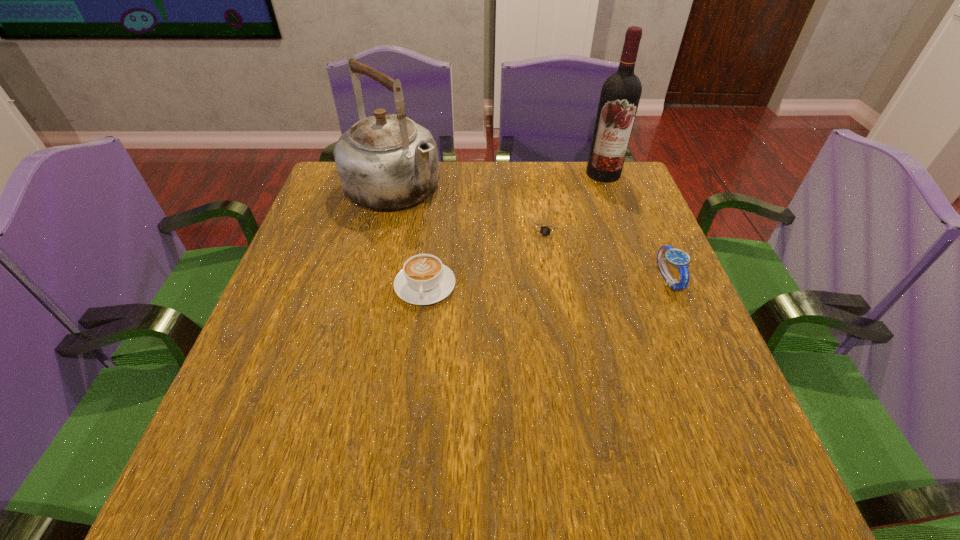
At what (x,y) coordinates should I click in order to perform the action: click on object that is at the left edge. Please return your answer as a coordinate pair (x, y). Looking at the image, I should click on (387, 161).

Image resolution: width=960 pixels, height=540 pixels. I want to click on watch located at the right edge, so click(x=678, y=258).

Find the location of a particular element. wine bottle at the right edge is located at coordinates (620, 95).

At what (x,y) coordinates should I click in order to perform the action: click on object present at the far left corner. Please return your answer as a coordinate pair (x, y). Looking at the image, I should click on (387, 161).

Where is `object at the far right corner`? The width and height of the screenshot is (960, 540). object at the far right corner is located at coordinates tap(620, 95).

Where is `vacant space at the far edge`? This screenshot has width=960, height=540. vacant space at the far edge is located at coordinates (483, 205).

Identify the location of vacant space at the left edge of the desktop. (326, 231).

Locate an element on the screen. This screenshot has height=540, width=960. vacant space at the right edge of the desktop is located at coordinates (703, 359).

In the image, there is a desktop. Find the location of `vacant space at the near left corner`. vacant space at the near left corner is located at coordinates (270, 392).

This screenshot has width=960, height=540. In the image, there is a desktop. In order to click on vacant space at the near right corner in this screenshot , I will do `click(733, 401)`.